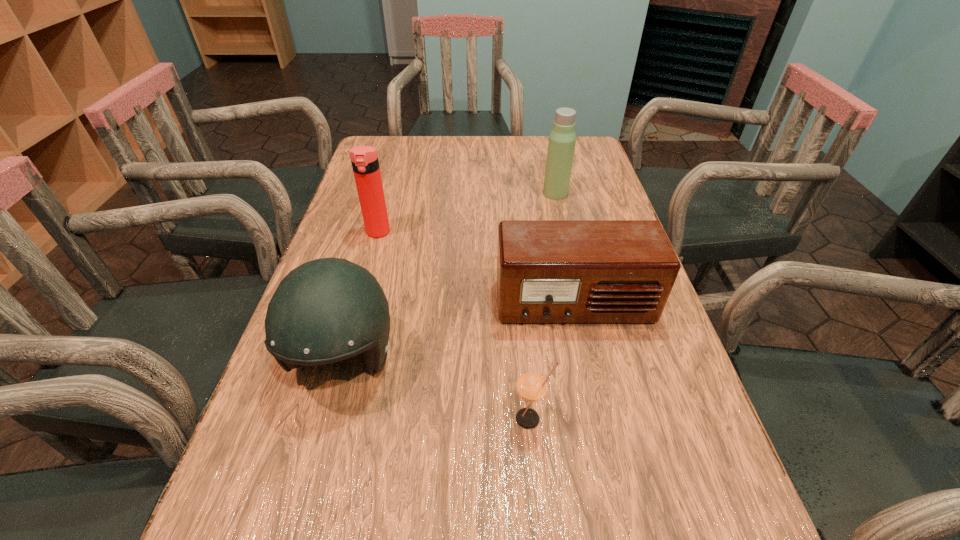
Locate an element on the screen. This screenshot has width=960, height=540. the right thermos bottle is located at coordinates (562, 139).

At what (x,y) coordinates should I click in order to perform the action: click on the farther thermos bottle. Please return your answer as a coordinate pair (x, y). Image resolution: width=960 pixels, height=540 pixels. Looking at the image, I should click on (562, 139).

This screenshot has width=960, height=540. I want to click on the left thermos bottle, so click(x=364, y=159).

At what (x,y) coordinates should I click in order to perform the action: click on the nearer thermos bottle. Please return your answer as a coordinate pair (x, y). The height and width of the screenshot is (540, 960). Looking at the image, I should click on (364, 159).

Where is `football helmet`? This screenshot has height=540, width=960. football helmet is located at coordinates (326, 310).

Find the location of a particular element. Image resolution: width=960 pixels, height=540 pixels. radio receiver is located at coordinates (548, 271).

The image size is (960, 540). What are the coordinates of `straw` in the screenshot? It's located at (532, 384).

I want to click on vacant space located on the left of the farther thermos bottle, so click(x=460, y=193).

The image size is (960, 540). What are the coordinates of `vacant space located 0.350m on the right of the left thermos bottle` in the screenshot? It's located at (526, 233).

Image resolution: width=960 pixels, height=540 pixels. In order to click on free spot located 0.110m at the face opening of the football helmet in this screenshot , I will do `click(310, 477)`.